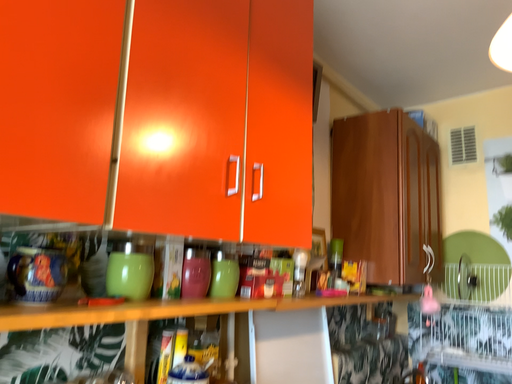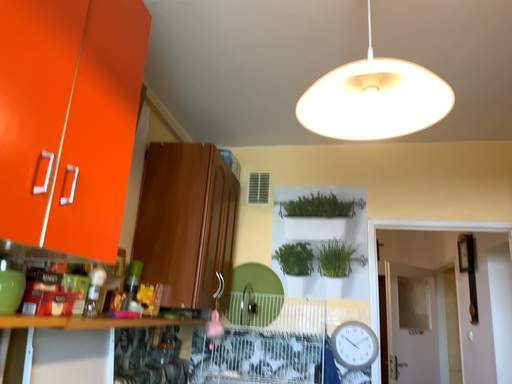
Question: How did the camera likely rotate when shooting the video?

Choices:
 (A) rotated right
 (B) rotated left

Answer: (A)